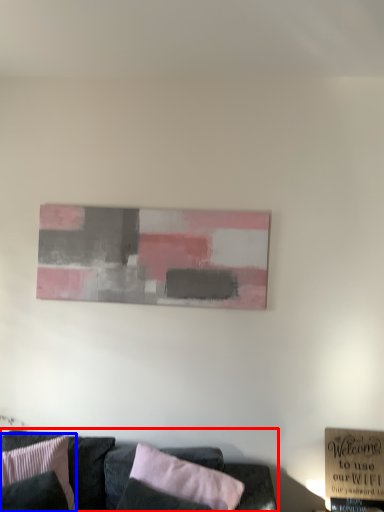
Question: Which object appears farthest to the camera in this image, studio couch (highlighted by a red box) or pillow (highlighted by a blue box)?

Choices:
 (A) studio couch
 (B) pillow

Answer: (B)